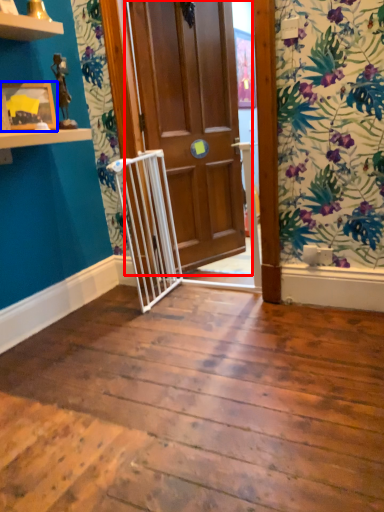
Question: Which object is closer to the camera taking this photo, door (highlighted by a red box) or picture frame (highlighted by a blue box)?

Choices:
 (A) door
 (B) picture frame

Answer: (B)